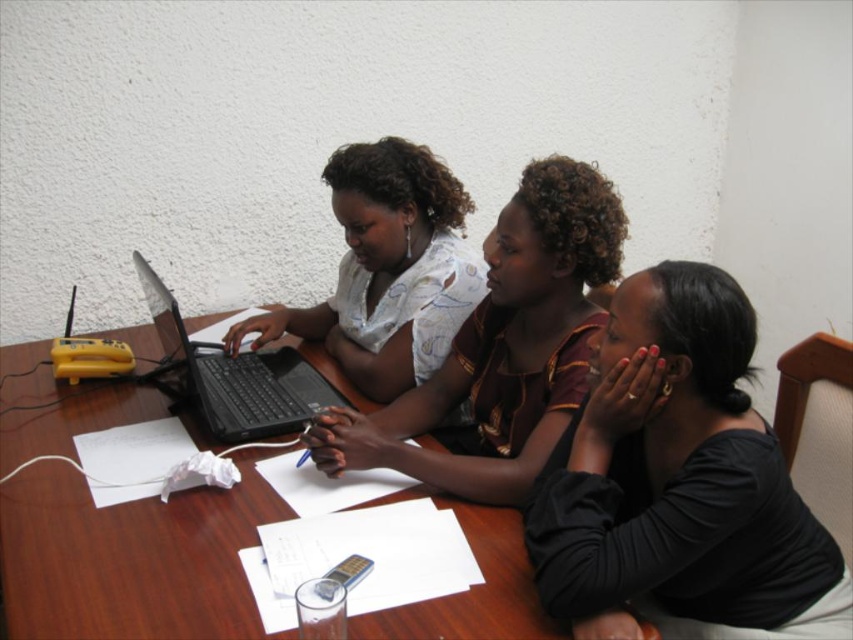
You are standing in front of the table and want to place a small object on the table. If you place it closer to the viewer, which point should you choose between point (148,516) and point (158,308)?

You should choose point (148,516) because it is closer to the viewer than point (158,308).

You are standing at the back of the room and want to place a small object on the table between the two points labeled point (611, 468) and point (496, 577). Which point should you aim for to ensure the object lands closer to the edge of the table?

You should aim for point (496, 577) because it is closer to the edge of the table compared to point (611, 468), which is further away from the edge towards the camera.